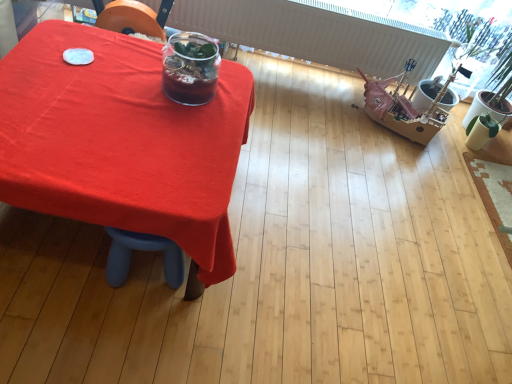
What do you see at coordinates (190, 68) in the screenshot?
I see `translucent glass jar at center` at bounding box center [190, 68].

Where is `translucent glass jar at center`? The image size is (512, 384). translucent glass jar at center is located at coordinates (190, 68).

Locate an element on the screen. The height and width of the screenshot is (384, 512). matte red tablecloth at center is located at coordinates (121, 141).

The height and width of the screenshot is (384, 512). What do you see at coordinates (121, 141) in the screenshot? I see `matte red tablecloth at center` at bounding box center [121, 141].

Find the location of a particular element. translucent glass jar at center is located at coordinates (190, 68).

Which object is positioned more to the right, translucent glass jar at center or matte red tablecloth at center?

From the viewer's perspective, translucent glass jar at center appears more on the right side.

Considering the positions of objects translucent glass jar at center and matte red tablecloth at center in the image provided, who is behind, translucent glass jar at center or matte red tablecloth at center?

Positioned behind is translucent glass jar at center.

Does point (179, 94) come behind point (6, 185)?

Yes, it is.

From the image's perspective, is translucent glass jar at center positioned above or below matte red tablecloth at center?

Clearly, from the image's perspective, translucent glass jar at center is above matte red tablecloth at center.

Looking at this image, from a real-world perspective, who is located lower, translucent glass jar at center or matte red tablecloth at center?

matte red tablecloth at center is physically lower.

Considering the relative sizes of translucent glass jar at center and matte red tablecloth at center in the image provided, is translucent glass jar at center thinner than matte red tablecloth at center?

Correct, the width of translucent glass jar at center is less than that of matte red tablecloth at center.

Can you confirm if translucent glass jar at center is shorter than matte red tablecloth at center?

Indeed, translucent glass jar at center has a lesser height compared to matte red tablecloth at center.

Is translucent glass jar at center smaller than matte red tablecloth at center?

Correct, translucent glass jar at center occupies less space than matte red tablecloth at center.

Can we say translucent glass jar at center lies outside matte red tablecloth at center?

translucent glass jar at center is positioned outside matte red tablecloth at center.

Are translucent glass jar at center and matte red tablecloth at center located far from each other?

Actually, translucent glass jar at center and matte red tablecloth at center are a little close together.

Based on the photo, is translucent glass jar at center positioned with its back to matte red tablecloth at center?

No, matte red tablecloth at center is not at the back of translucent glass jar at center.

What's the angular difference between translucent glass jar at center and matte red tablecloth at center's facing directions?

translucent glass jar at center and matte red tablecloth at center are facing 2.41e-05 degrees away from each other.

Measure the distance between translucent glass jar at center and matte red tablecloth at center.

10.11 inches.

This screenshot has width=512, height=384. Find the location of `table that is under the translucent glass jar at center (from a real-world perspective)`. table that is under the translucent glass jar at center (from a real-world perspective) is located at coordinates (121, 141).

Is matte red tablecloth at center at the right side of translucent glass jar at center?

Incorrect, matte red tablecloth at center is not on the right side of translucent glass jar at center.

Does matte red tablecloth at center come in front of translucent glass jar at center?

Yes, matte red tablecloth at center is closer to the camera.

Is point (106, 199) behind point (194, 90)?

No, (106, 199) is in front of (194, 90).

From the image's perspective, is matte red tablecloth at center located above or below translucent glass jar at center?

Based on their image positions, matte red tablecloth at center is located beneath translucent glass jar at center.

From a real-world perspective, between matte red tablecloth at center and translucent glass jar at center, who is vertically lower?

In real-world perspective, matte red tablecloth at center is lower.

Which of these two, matte red tablecloth at center or translucent glass jar at center, is wider?

With larger width is matte red tablecloth at center.

Between matte red tablecloth at center and translucent glass jar at center, which one has less height?

Answer: Standing shorter between the two is translucent glass jar at center.

Can you confirm if matte red tablecloth at center is bigger than translucent glass jar at center?

Yes, matte red tablecloth at center is bigger than translucent glass jar at center.

Is matte red tablecloth at center located outside translucent glass jar at center?

matte red tablecloth at center is positioned outside translucent glass jar at center.

Is matte red tablecloth at center touching translucent glass jar at center?

No.

Could you tell me if matte red tablecloth at center is facing translucent glass jar at center?

No, matte red tablecloth at center is not turned towards translucent glass jar at center.

How different are the orientations of matte red tablecloth at center and translucent glass jar at center in degrees?

They differ by 2.41e-05 degrees in their facing directions.

Measure the distance from matte red tablecloth at center to translucent glass jar at center.

matte red tablecloth at center and translucent glass jar at center are 10.11 inches apart.

At what (x,y) coordinates should I click in order to perform the action: click on drink behind the matte red tablecloth at center. Please return your answer as a coordinate pair (x, y). The width and height of the screenshot is (512, 384). Looking at the image, I should click on (190, 68).

Image resolution: width=512 pixels, height=384 pixels. There is a matte red tablecloth at center. Find the location of `drink above it (from a real-world perspective)`. drink above it (from a real-world perspective) is located at coordinates (190, 68).

Image resolution: width=512 pixels, height=384 pixels. Find the location of `table below the translucent glass jar at center (from the image's perspective)`. table below the translucent glass jar at center (from the image's perspective) is located at coordinates (121, 141).